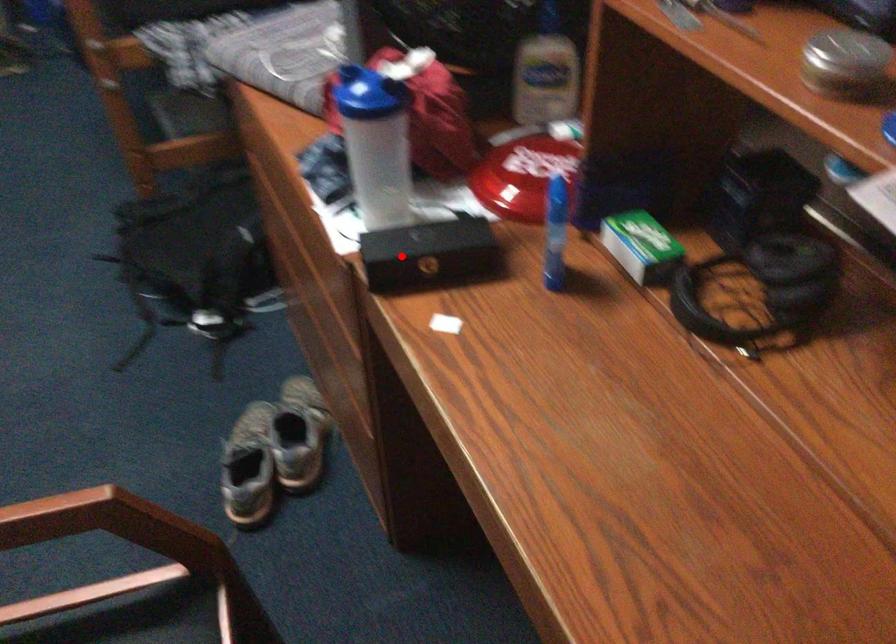
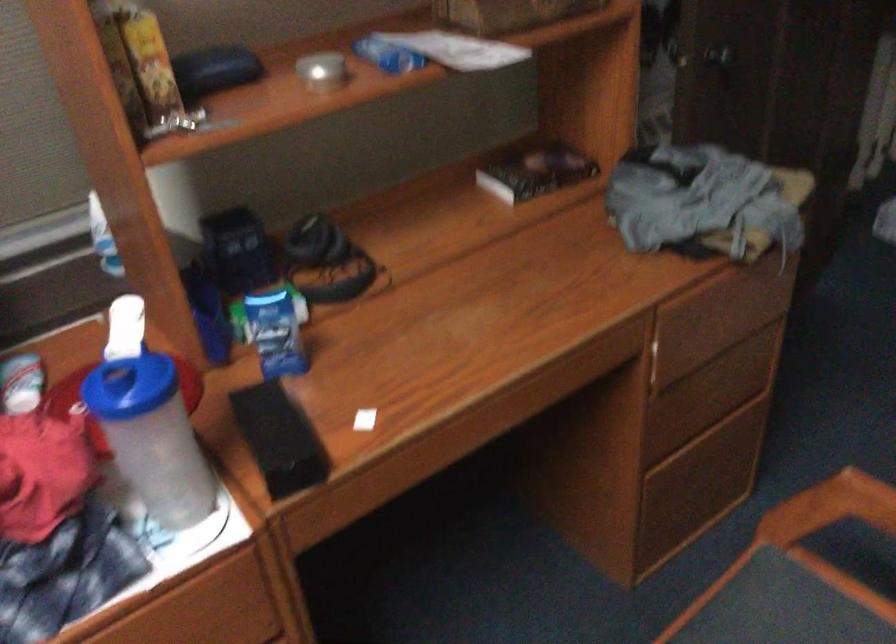
In the second image, find the point that corresponds to the highlighted location in the first image.

(279, 438)